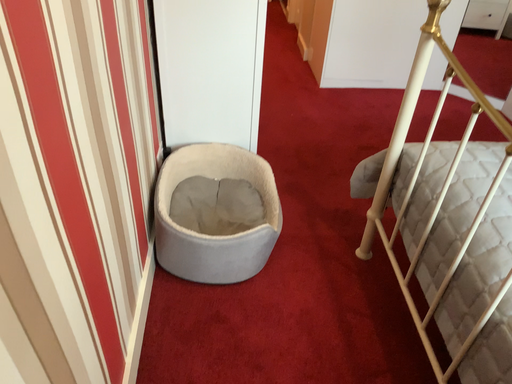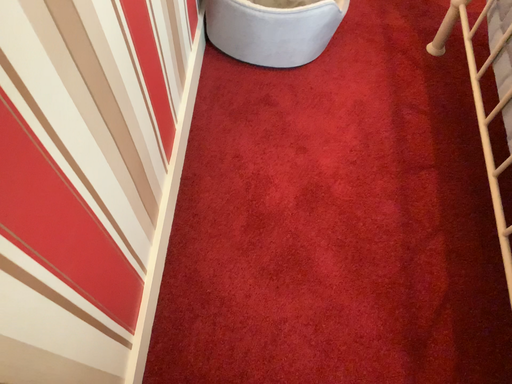
Question: Which way did the camera rotate in the video?

Choices:
 (A) rotated upward
 (B) rotated downward

Answer: (B)